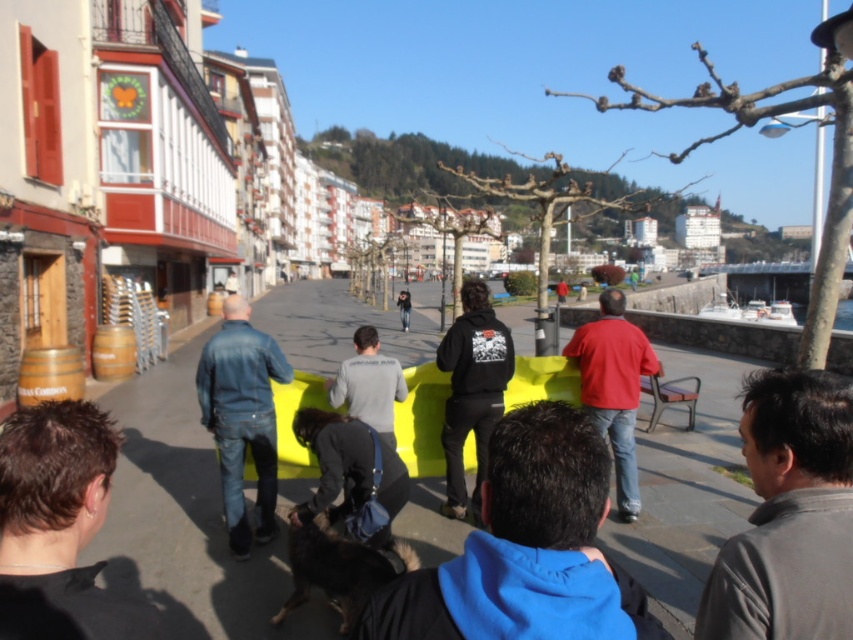
Can you confirm if black matte hoodie at center is bigger than matte red sweatshirt at center?

Yes, black matte hoodie at center is bigger than matte red sweatshirt at center.

Is point (496, 356) positioned before point (593, 396)?

Yes, point (496, 356) is closer to viewer.

Does point (454, 460) come behind point (624, 333)?

No, (454, 460) is closer to viewer.

The width and height of the screenshot is (853, 640). Identify the location of black matte hoodie at center. (473, 388).

Is dark brown hair at lower left shorter than dark gray fleece sweatshirt at center?

Indeed, dark brown hair at lower left has a lesser height compared to dark gray fleece sweatshirt at center.

Is point (90, 468) behind point (495, 387)?

No, (90, 468) is in front of (495, 387).

Between point (50, 580) and point (492, 332), which one is positioned behind?

Positioned behind is point (492, 332).

Identify the location of dark brown hair at lower left. tap(62, 515).

Which is above, blue fleece jacket at center or matte red sweatshirt at center?

matte red sweatshirt at center is above.

Is point (585, 616) closer to viewer compared to point (590, 378)?

Yes, it is in front of point (590, 378).

Find the location of a particular element. The height and width of the screenshot is (640, 853). blue fleece jacket at center is located at coordinates (525, 548).